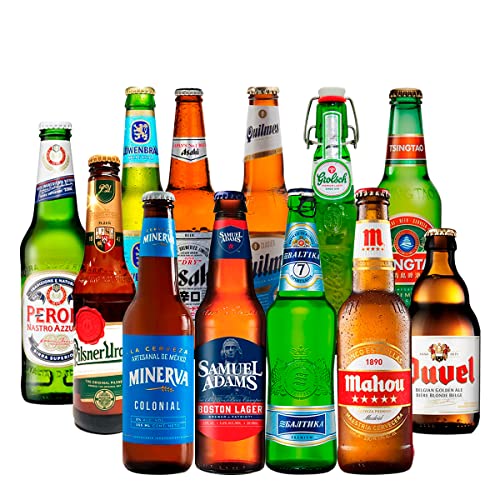
Locate an element on the screen. amber bottle is located at coordinates (443, 297), (370, 315), (232, 305), (159, 309), (102, 272), (190, 177), (271, 179).